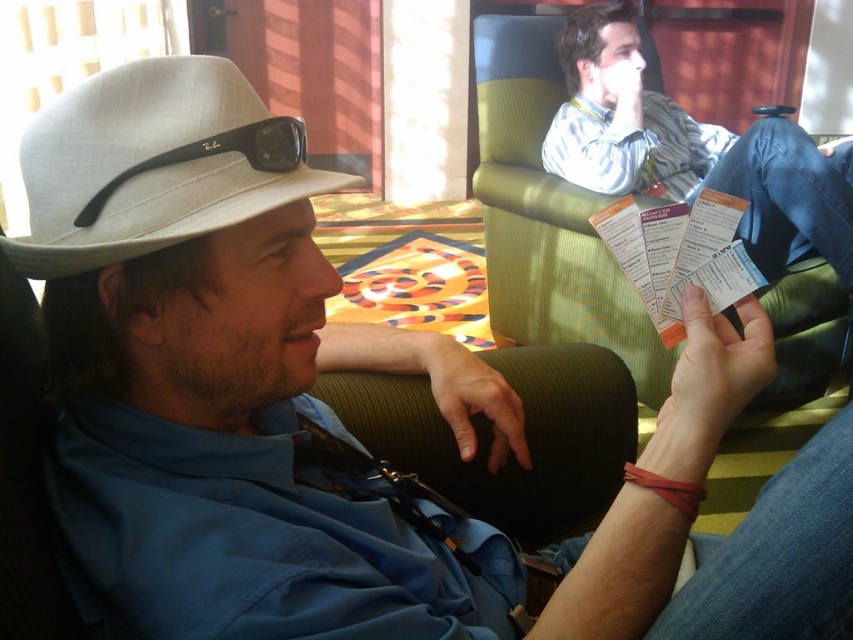
Does white fabric fedora at left appear on the right side of striped cotton shirt at upper right?

No, white fabric fedora at left is not to the right of striped cotton shirt at upper right.

Looking at this image, which is more to the right, white fabric fedora at left or striped cotton shirt at upper right?

Positioned to the right is striped cotton shirt at upper right.

Who is more forward, (x=258, y=204) or (x=792, y=253)?

Point (x=258, y=204) is more forward.

The image size is (853, 640). Find the location of `white fabric fedora at left`. white fabric fedora at left is located at coordinates (154, 163).

In the scene shown: Can you confirm if striped cotton shirt at upper right is smaller than matte black sunglasses at upper left?

Incorrect, striped cotton shirt at upper right is not smaller in size than matte black sunglasses at upper left.

Which is below, striped cotton shirt at upper right or matte black sunglasses at upper left?

matte black sunglasses at upper left is below.

Is point (730, 150) in front of point (80, 214)?

No.

Find the location of a particular element. The height and width of the screenshot is (640, 853). striped cotton shirt at upper right is located at coordinates (694, 148).

Does point (143, 234) lie in front of point (264, 141)?

Yes, point (143, 234) is in front of point (264, 141).

Can you confirm if white fabric fedora at left is bigger than matte black sunglasses at upper left?

Yes, white fabric fedora at left is bigger than matte black sunglasses at upper left.

Between point (192, 211) and point (94, 195), which one is positioned in front?

Positioned in front is point (192, 211).

Image resolution: width=853 pixels, height=640 pixels. I want to click on white fabric fedora at left, so coord(154,163).